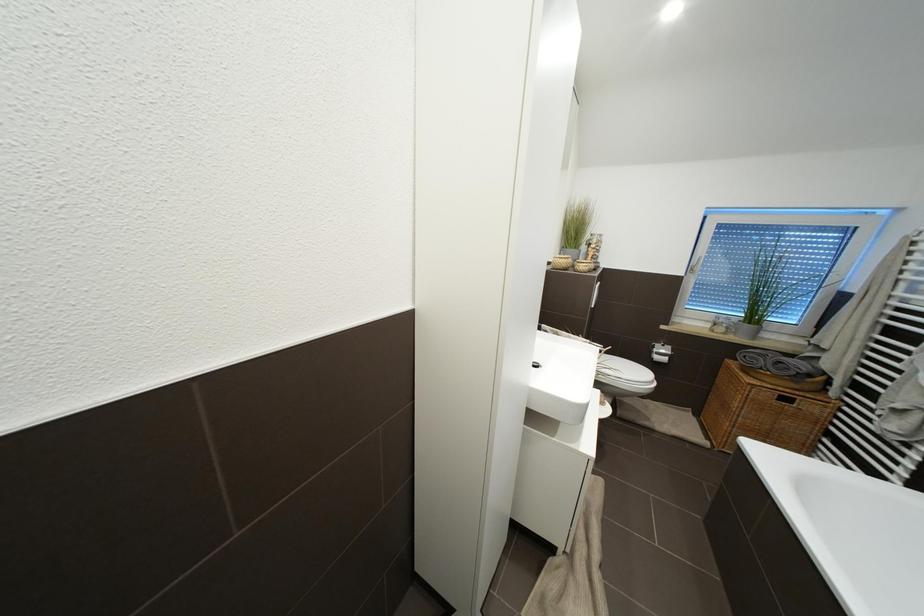
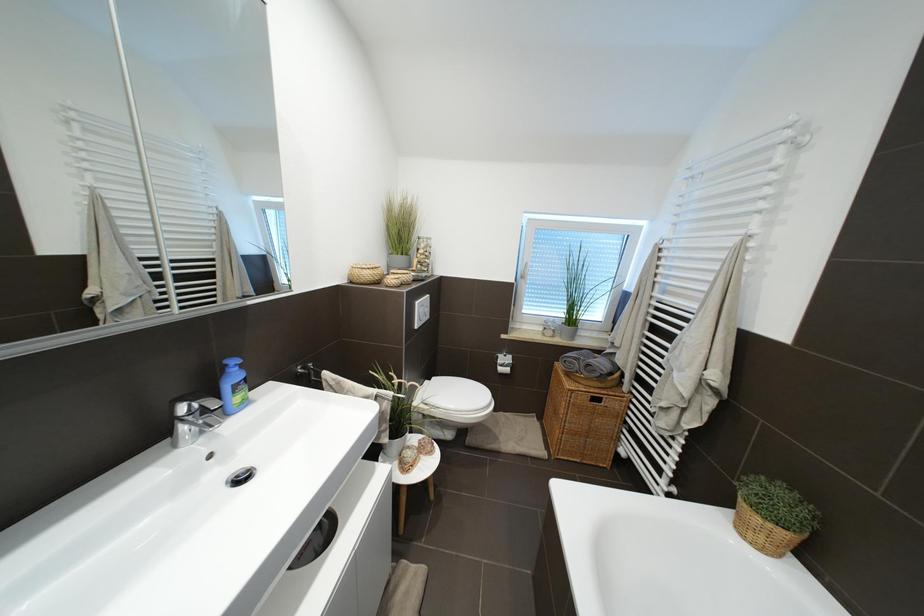
Question: The first image is from the beginning of the video and the second image is from the end. How did the camera likely rotate when shooting the video?

Choices:
 (A) Left
 (B) Right
 (C) Up
 (D) Down

Answer: (B)